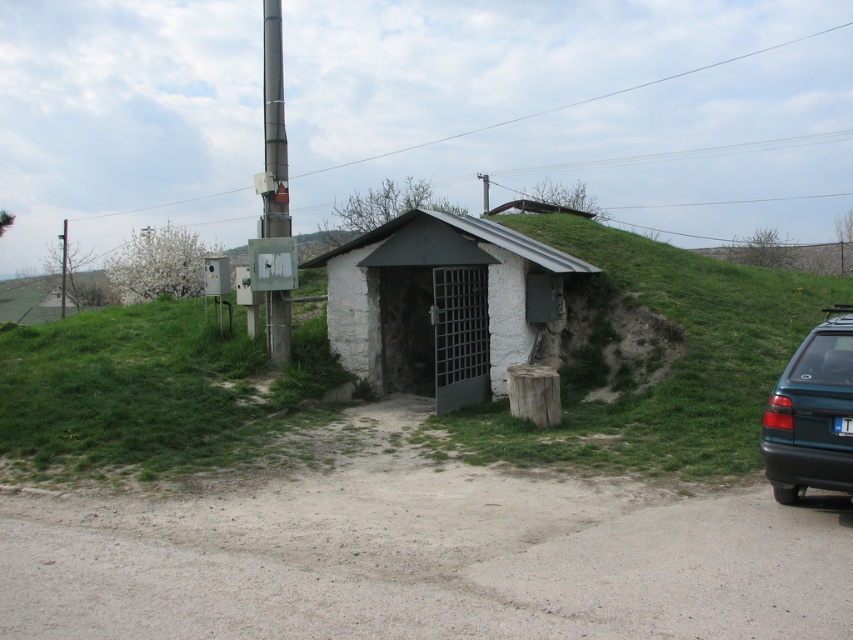
Question: Does green grassy at center have a larger size compared to teal matte hatchback at right?

Choices:
 (A) no
 (B) yes

Answer: (B)

Question: Which point is closer to the camera?

Choices:
 (A) (845, 422)
 (B) (837, 408)

Answer: (A)

Question: Among these points, which one is nearest to the camera?

Choices:
 (A) (276, 324)
 (B) (425, 294)

Answer: (A)

Question: Is white stucco hut at center closer to the viewer compared to white plastic license plate at right?

Choices:
 (A) yes
 (B) no

Answer: (B)

Question: Estimate the real-world distances between objects in this image. Which object is farther from the metallic pole at left?

Choices:
 (A) teal matte hatchback at right
 (B) white plastic license plate at right
 (C) white stucco hut at center

Answer: (A)

Question: Does white stucco hut at center appear on the left side of teal matte hatchback at right?

Choices:
 (A) yes
 (B) no

Answer: (A)